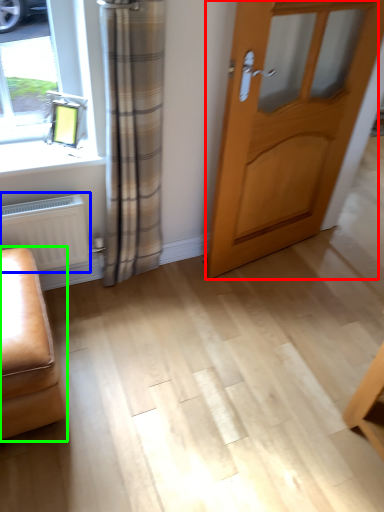
Question: Which object is the closest to the door (highlighted by a red box)? Choose among these: radiator (highlighted by a blue box) or furniture (highlighted by a green box).

Choices:
 (A) radiator
 (B) furniture

Answer: (A)